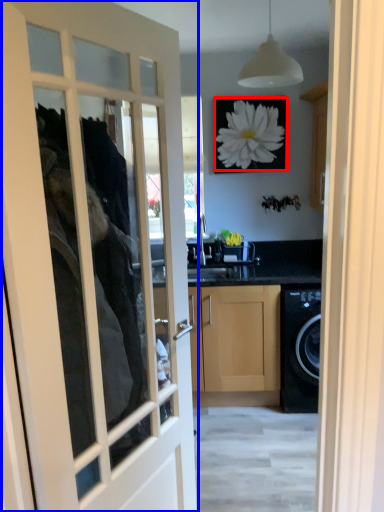
Question: Which object is closer to the camera taking this photo, flower (highlighted by a red box) or door (highlighted by a blue box)?

Choices:
 (A) flower
 (B) door

Answer: (B)